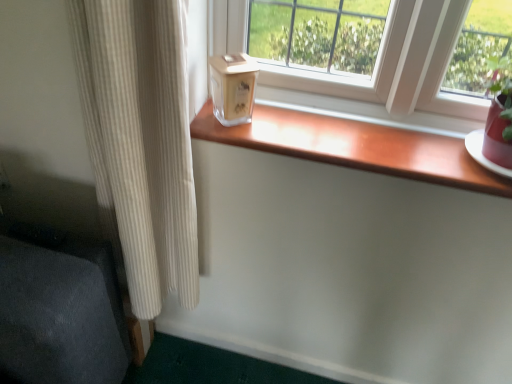
I want to click on vacant region above wooden at center (from a real-world perspective), so click(352, 133).